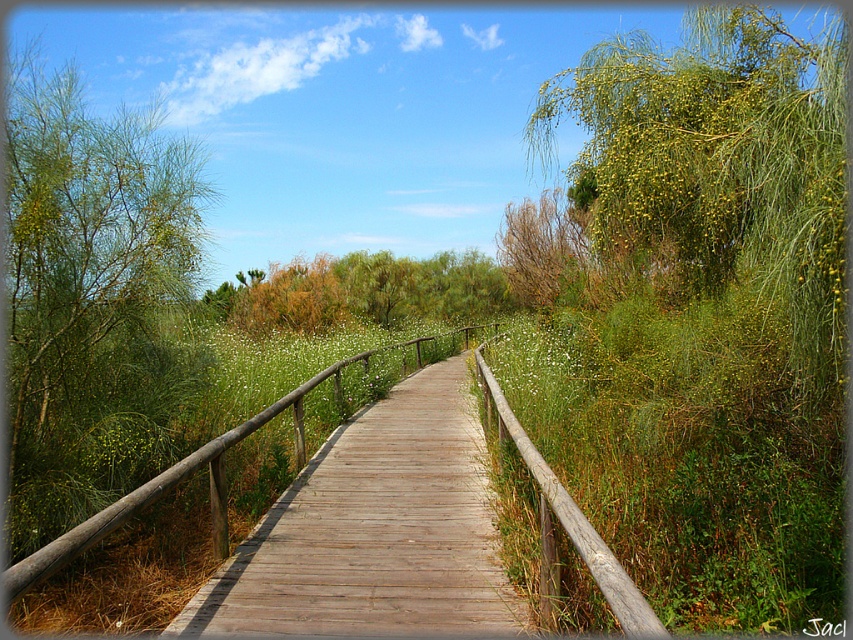
Which is above, green grassy at right or green leafy tree at left?

green leafy tree at left is higher up.

Is green grassy at right behind green leafy tree at left?

No, it is not.

Image resolution: width=853 pixels, height=640 pixels. Identify the location of green grassy at right. (688, 458).

Locate an element on the screen. The height and width of the screenshot is (640, 853). green grassy at right is located at coordinates (688, 458).

Can you confirm if green leafy tree at left is taller than brown textured bush at upper center?

In fact, green leafy tree at left may be shorter than brown textured bush at upper center.

Between point (19, 257) and point (587, 292), which one is positioned behind?

The point (587, 292) is more distant.

At what (x,y) coordinates should I click in order to perform the action: click on green leafy tree at left. Please return your answer as a coordinate pair (x, y). This screenshot has width=853, height=640. Looking at the image, I should click on [x=91, y=296].

Does green grassy at right lie in front of wooden boardwalk at center?

Yes, green grassy at right is in front of wooden boardwalk at center.

Which of these two, green grassy at right or wooden boardwalk at center, stands shorter?

wooden boardwalk at center

Between point (679, 483) and point (503, 573), which one is positioned in front?

Positioned in front is point (503, 573).

The height and width of the screenshot is (640, 853). I want to click on green grassy at right, so click(x=688, y=458).